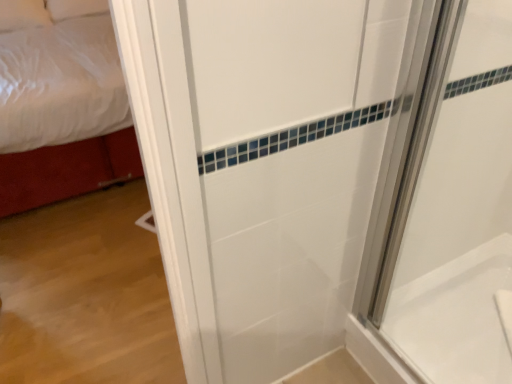
Question: Is point (497, 319) positioned closer to the camera than point (108, 168)?

Choices:
 (A) farther
 (B) closer

Answer: (B)

Question: In the image, is white glossy bathtub at lower right on the left side or the right side of white fabric bed at left?

Choices:
 (A) left
 (B) right

Answer: (B)

Question: Based on their relative distances, which object is farther from the white fabric bed at left?

Choices:
 (A) white glossy shower door at right
 (B) white glossy bathtub at lower right

Answer: (B)

Question: Which object is positioned closest to the white fabric bed at left?

Choices:
 (A) white glossy shower door at right
 (B) white glossy bathtub at lower right

Answer: (A)